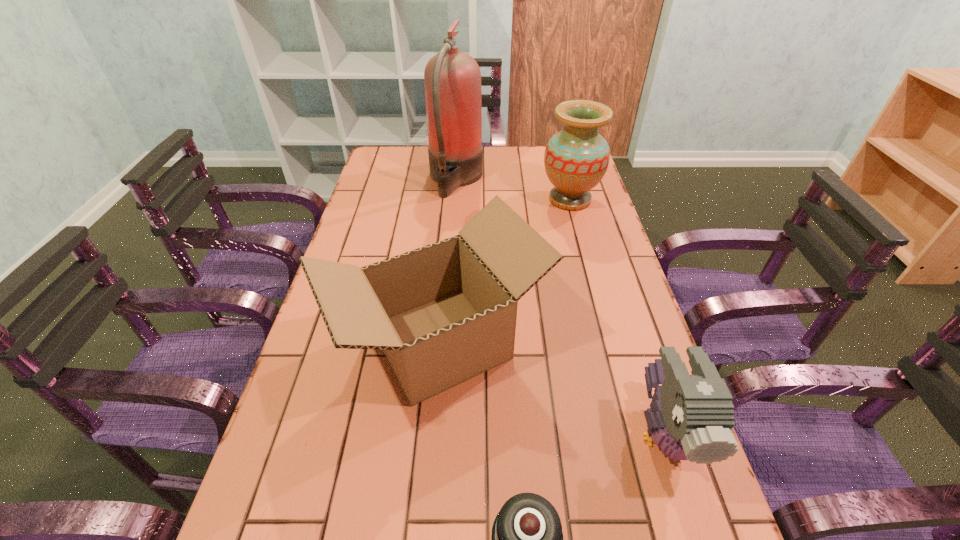
This screenshot has width=960, height=540. I want to click on vacant space that satisfies the following two spatial constraints: 1. at the nozzle of the tallest object; 2. on the left side of the vase, so click(x=454, y=200).

Identify the location of blank area in the image that satisfies the following two spatial constraints: 1. at the nozzle of the tallest object; 2. on the left side of the vase. Image resolution: width=960 pixels, height=540 pixels. (454, 200).

You are a GUI agent. You are given a task and a screenshot of the screen. Output one action in this format:
    pyautogui.click(x=<x>, y=<y>)
    Task: Click on the free space that satisfies the following two spatial constraints: 1. at the nozzle of the tallest object; 2. on the left side of the vase
    The image size is (960, 540).
    Given the screenshot: What is the action you would take?
    pyautogui.click(x=454, y=200)